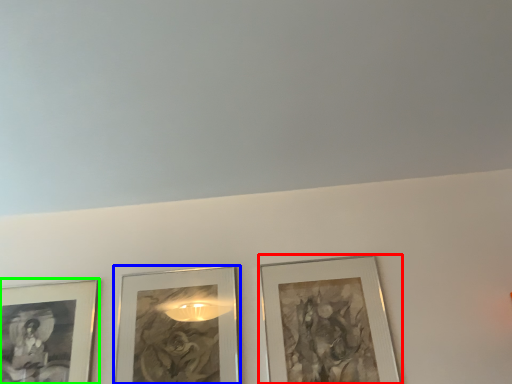
Question: Which is nearer to the picture frame (highlighted by a red box)? picture frame (highlighted by a blue box) or picture frame (highlighted by a green box).

Choices:
 (A) picture frame
 (B) picture frame

Answer: (A)